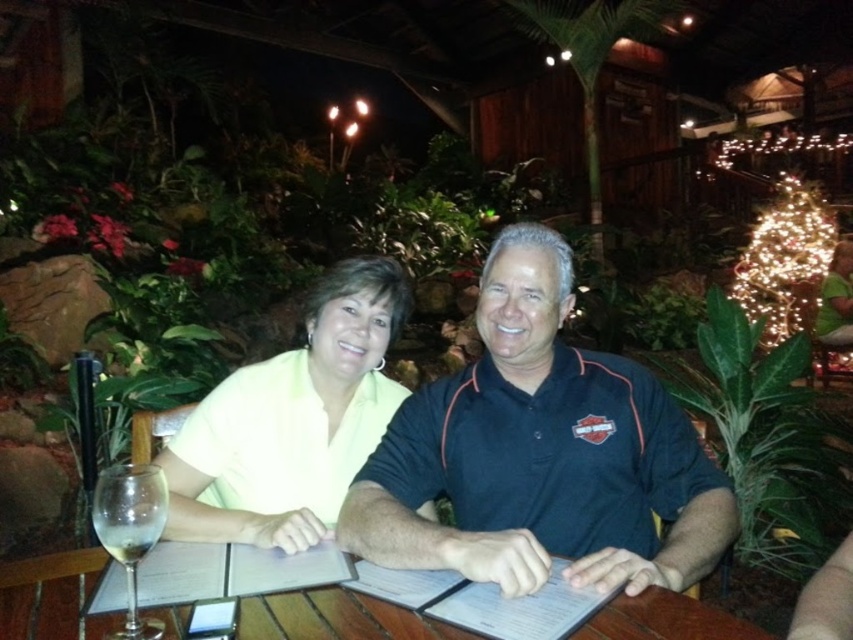
You are a photographer standing behind the table where the dark blue polo shirt at center and yellow matte shirt at center are seated. You want to capture a photo that includes both guests without them overlapping in the frame. Given the distance between them, what is the minimum focal length lens you should use if your camera sensor size is 36mm x 24mm and the subjects are 2 meters away from the camera?

The minimum focal length lens required would depend on calculating the angle of view needed to fit both subjects within the frame while maintaining their separation. However, the provided information about the 11.06 inches distance between the dark blue polo shirt at center and yellow matte shirt at center and their positions at 2 meters away can be used to determine this. Using basic photography formulas, the angle of view must accommodate both guests separated by approximately 28.1 cm. A focal length of 5

You are standing at the entrance of the outdoor dining area and want to find the dark blue polo shirt at center. According to the coordinates provided, in which direction should you look to locate it?

The dark blue polo shirt at center is located at point coordinates [541,452], which means you should look towards the lower right direction to find it.